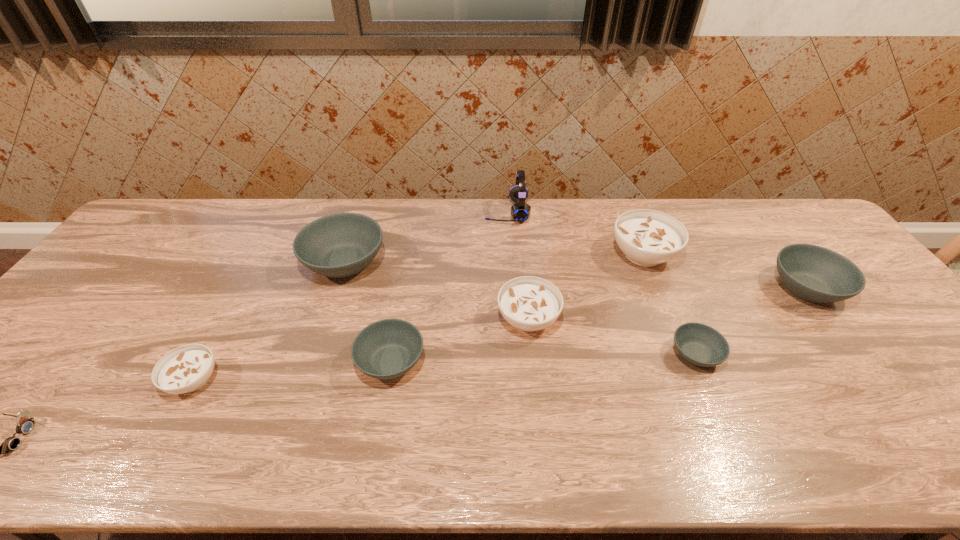
Where is `the nearest white soup bowl`? This screenshot has height=540, width=960. the nearest white soup bowl is located at coordinates (187, 368).

Find the location of a particular element. the leftmost white soup bowl is located at coordinates (187, 368).

Find the location of `the smallest gray soup bowl`. the smallest gray soup bowl is located at coordinates (701, 345).

The height and width of the screenshot is (540, 960). I want to click on the shortest soup bowl, so [701, 345].

Locate an element on the screen. This screenshot has height=540, width=960. vacant space situated on the ear cushions of the farthest object is located at coordinates (374, 212).

The height and width of the screenshot is (540, 960). In order to click on vacant space situated 0.300m on the ear cushions of the farthest object in this screenshot , I will do `click(397, 212)`.

What are the coordinates of `vacant area situated on the ear cushions of the farthest object` in the screenshot? It's located at (441, 212).

This screenshot has width=960, height=540. I want to click on free space located on the front of the farthest white soup bowl, so click(x=690, y=372).

I want to click on vacant space located 0.280m on the front of the biggest gray soup bowl, so click(307, 377).

At what (x,y) coordinates should I click in order to perform the action: click on vacant area situated on the back of the rightmost soup bowl. Please return your answer as a coordinate pair (x, y). The height and width of the screenshot is (540, 960). Looking at the image, I should click on (748, 210).